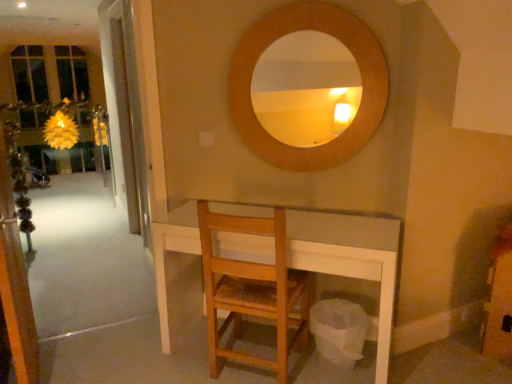
Question: Is clear glass door at left, the first screen door in the back-to-front sequence, at the left side of transparent glass screen door at left, the second screen door from the back?

Choices:
 (A) no
 (B) yes

Answer: (A)

Question: From the image's perspective, is clear glass door at left, which is counted as the 2th screen door, starting from the front, under transparent glass screen door at left, which is the first screen door from front to back?

Choices:
 (A) yes
 (B) no

Answer: (B)

Question: Considering the relative sizes of clear glass door at left, the first screen door in the back-to-front sequence, and transparent glass screen door at left, the second screen door from the back, in the image provided, is clear glass door at left, the first screen door in the back-to-front sequence, shorter than transparent glass screen door at left, the second screen door from the back,?

Choices:
 (A) yes
 (B) no

Answer: (B)

Question: Is clear glass door at left, which is counted as the 2th screen door, starting from the front, aimed at transparent glass screen door at left, which is the first screen door from front to back?

Choices:
 (A) yes
 (B) no

Answer: (B)

Question: Is clear glass door at left, which is counted as the 2th screen door, starting from the front, not within transparent glass screen door at left, which is the first screen door from front to back?

Choices:
 (A) yes
 (B) no

Answer: (A)

Question: Is clear glass door at left, which is counted as the 2th screen door, starting from the front, not close to transparent glass screen door at left, the second screen door from the back?

Choices:
 (A) yes
 (B) no

Answer: (A)

Question: Can you confirm if wooden chair at center is smaller than wooden circle at upper center?

Choices:
 (A) yes
 (B) no

Answer: (B)

Question: Considering the relative sizes of wooden chair at center and wooden circle at upper center in the image provided, is wooden chair at center shorter than wooden circle at upper center?

Choices:
 (A) yes
 (B) no

Answer: (B)

Question: Is wooden chair at center bigger than wooden circle at upper center?

Choices:
 (A) yes
 (B) no

Answer: (A)

Question: Is wooden circle at upper center surrounded by wooden chair at center?

Choices:
 (A) no
 (B) yes

Answer: (A)

Question: Is wooden chair at center beside wooden circle at upper center?

Choices:
 (A) no
 (B) yes

Answer: (A)

Question: Is wooden chair at center completely or partially outside of wooden circle at upper center?

Choices:
 (A) yes
 (B) no

Answer: (A)

Question: Does wooden chair at center have a greater width compared to clear glass door at left, the first screen door in the back-to-front sequence?

Choices:
 (A) yes
 (B) no

Answer: (A)